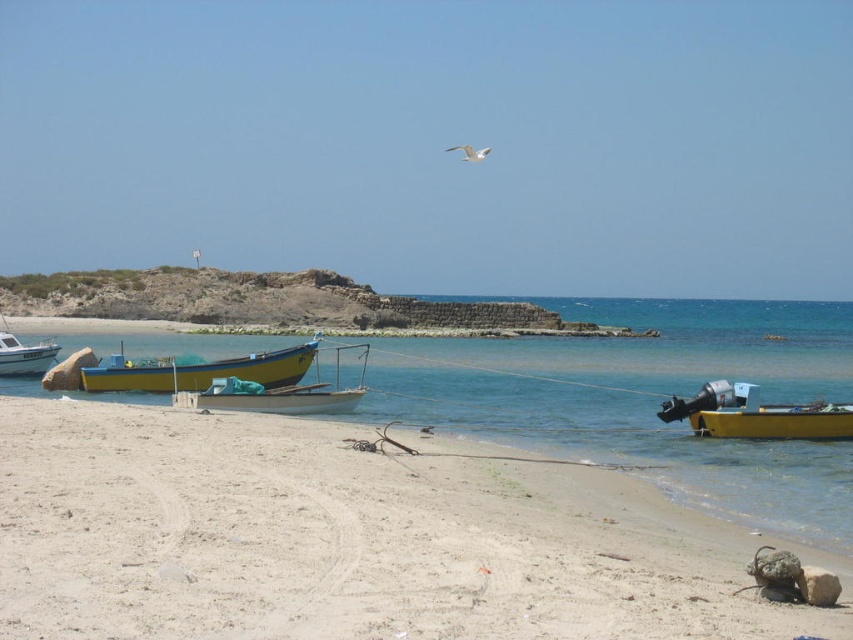
In the scene shown: You are standing on the beach and want to walk from the wooden boat at center to the yellow matte boat at lower right. Which direction should you head?

The yellow matte boat at lower right is located below the wooden boat at center, so you should head downward towards it.

You are standing on the wooden boat at center and want to walk to the white sandy beach at lower left. In which direction should you go?

The white sandy beach at lower left is to the right of the wooden boat at center, so you should walk to the right to reach it.

You are planning to set up a small tent on the white sandy beach at lower left and the yellow matte boat at lower right. Which location would allow the tent to fit more comfortably?

The white sandy beach at lower left might be wider than yellow matte boat at lower right, so the tent would fit more comfortably there.